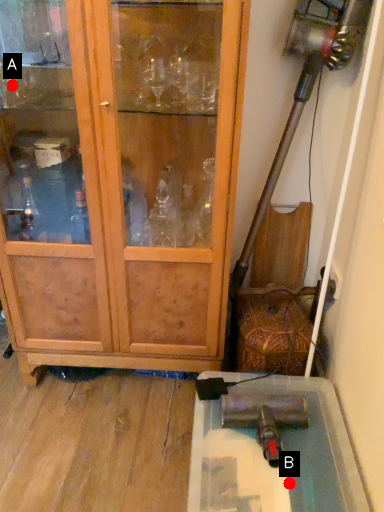
Question: Two points are circled on the image, labeled by A and B beside each circle. Which point appears farthest from the camera in this image?

Choices:
 (A) A is further
 (B) B is further

Answer: (A)